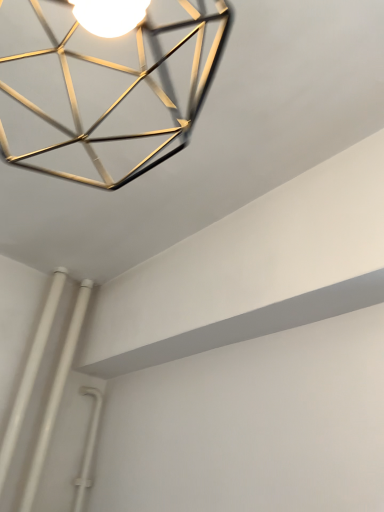
Question: Looking at their shapes, would you say white plastic pipes at lower left is wider or thinner than gold metallic geometric frame at upper center?

Choices:
 (A) wide
 (B) thin

Answer: (B)

Question: Which is correct: white plastic pipes at lower left is inside gold metallic geometric frame at upper center, or outside of it?

Choices:
 (A) inside
 (B) outside

Answer: (B)

Question: From a real-world perspective, is white plastic pipes at lower left physically located above or below gold metallic geometric frame at upper center?

Choices:
 (A) below
 (B) above

Answer: (A)

Question: From a real-world perspective, is gold metallic geometric frame at upper center positioned above or below white plastic pipes at lower left?

Choices:
 (A) above
 (B) below

Answer: (A)

Question: Looking at the image, does gold metallic geometric frame at upper center seem bigger or smaller compared to white plastic pipes at lower left?

Choices:
 (A) big
 (B) small

Answer: (A)

Question: Relative to white plastic pipes at lower left, is gold metallic geometric frame at upper center in front or behind?

Choices:
 (A) behind
 (B) front

Answer: (B)

Question: Is gold metallic geometric frame at upper center wider or thinner than white plastic pipes at lower left?

Choices:
 (A) wide
 (B) thin

Answer: (A)